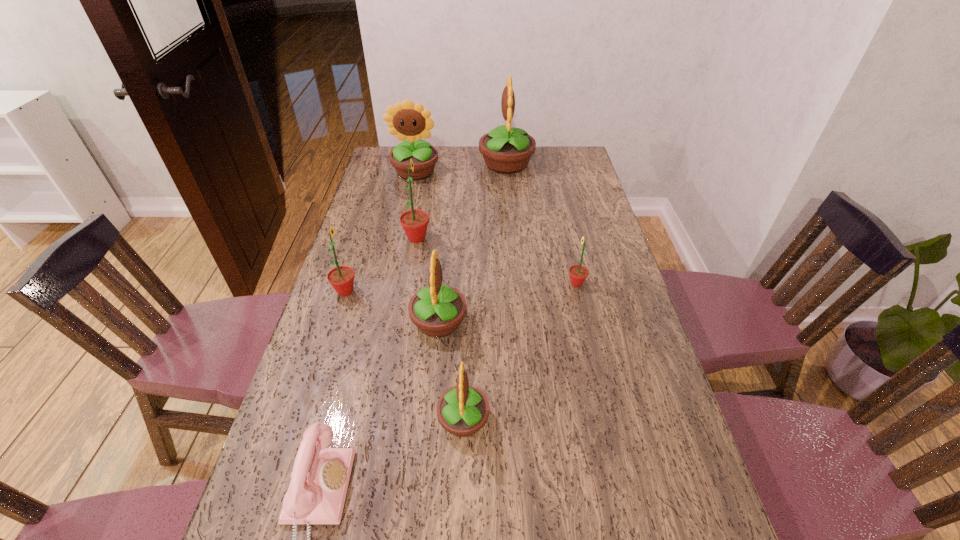
Where is `the tallest object`? the tallest object is located at coordinates (506, 150).

Where is `the tallest sunflower`? This screenshot has height=540, width=960. the tallest sunflower is located at coordinates (506, 150).

The height and width of the screenshot is (540, 960). I want to click on the second biggest yellow sunflower, so click(x=408, y=121).

Image resolution: width=960 pixels, height=540 pixels. What are the coordinates of `the farthest green sunflower` in the screenshot? It's located at (414, 222).

Locate an element on the screen. Image resolution: width=960 pixels, height=540 pixels. the biggest green sunflower is located at coordinates (414, 222).

Find the location of a particular element. The image size is (960, 540). the sixth farthest sunflower is located at coordinates (437, 310).

At what (x,y) coordinates should I click in order to perform the action: click on the third biggest yellow sunflower. Please return your answer as a coordinate pair (x, y). The image size is (960, 540). Looking at the image, I should click on (437, 310).

This screenshot has width=960, height=540. In order to click on the leftmost green sunflower in this screenshot , I will do (x=341, y=278).

This screenshot has height=540, width=960. I want to click on the smallest yellow sunflower, so click(462, 410).

Find the location of `the nearest yellow sunflower`. the nearest yellow sunflower is located at coordinates (462, 410).